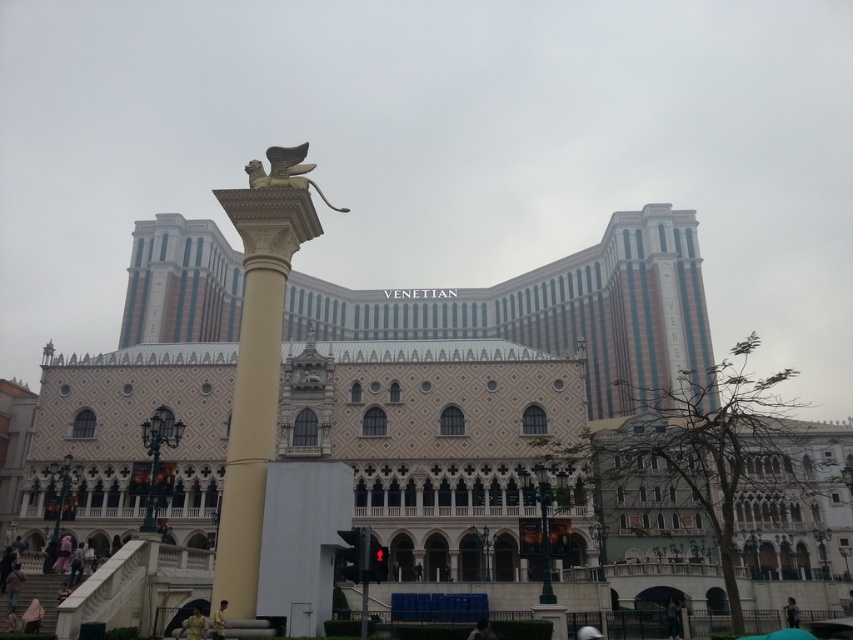
You are standing at the entrance of the Venetian Macao and see two points marked on the building facade. One is at coordinates point (x=242, y=198) and the other at point (x=219, y=602). Which point is closer to you?

Point (x=219, y=602) is closer to you because it is in front of point (x=242, y=198).

Based on the photo, you are standing outside the Venetian Macao and want to take a photo of the gold polished column at center. If your camera can focus on objects up to 100 feet away, will you need to move closer to take a clear photo?

The gold polished column at center is 124.43 feet away from the viewer. Since the camera can only focus up to 100 feet, you need to move closer to ensure the photo is clear.

You are standing in front of the Venetian Macao hotel. There is a golden winged lion statue on a large white column at the center. Where is the point located at coordinate (258, 356)?

The point at coordinate (258, 356) is on the gold polished column at center.